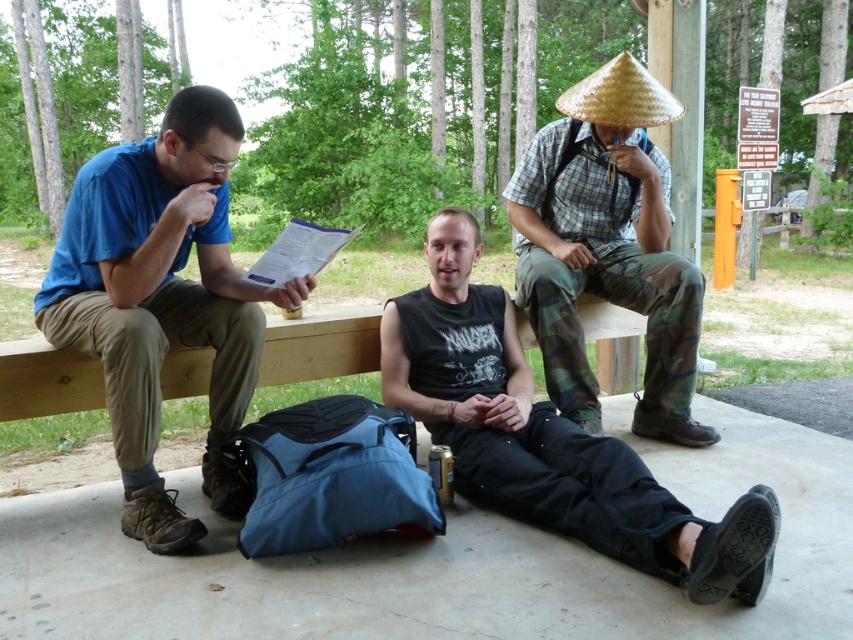
Question: In this image, where is black matte tank top at center located relative to natural straw hat at upper right?

Choices:
 (A) below
 (B) above

Answer: (A)

Question: Which point is closer to the camera taking this photo?

Choices:
 (A) (96, 403)
 (B) (119, 403)
 (C) (471, 442)

Answer: (B)

Question: Can you confirm if black matte tank top at center is positioned above wooden bench at center?

Choices:
 (A) no
 (B) yes

Answer: (A)

Question: Estimate the real-world distances between objects in this image. Which object is farther from the natural straw hat at upper right?

Choices:
 (A) wooden bench at center
 (B) black matte tank top at center

Answer: (A)

Question: Which of the following is the farthest from the observer?

Choices:
 (A) (195, 220)
 (B) (686, 417)

Answer: (B)

Question: Is matte blue shirt at left bigger than natural straw hat at upper right?

Choices:
 (A) yes
 (B) no

Answer: (B)